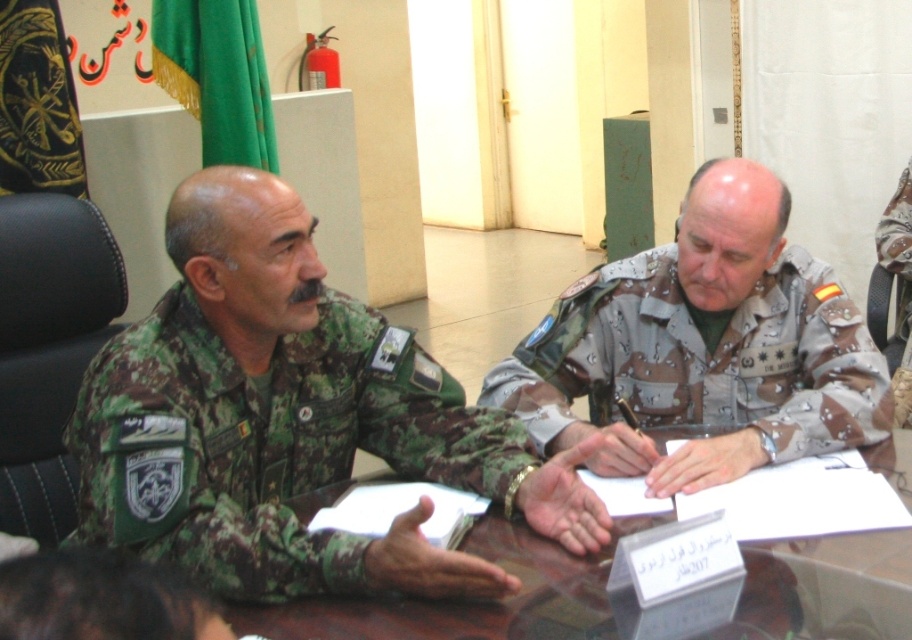
You are a photographer standing at the camera position. You want to take a closeup photo of the camouflage uniform at left without moving the camera. Is it possible to zoom in enough to capture the uniform details clearly?

The camouflage uniform at left is 1.36 meters away from camera, so yes, it is possible to zoom in enough to capture the uniform details clearly as it is within a reasonable distance for a closeup.

You are a photographer standing at the back of the room. You need to take a photo of the camouflage fabric uniform at center and the transparent glass table at center. Which object will appear larger in the photo?

The camouflage fabric uniform at center will appear larger in the photo because it is much taller than the transparent glass table at center.

You are a military assistant who needs to place a 12 inch long report on the table between the camouflage uniform at left and the camouflage fabric uniform at center. Can the report fit between them without overlapping either uniform?

The camouflage uniform at left and camouflage fabric uniform at center are 16.42 inches apart. Since the report is 12 inches long, there is enough space between them to place the report without overlapping either uniform.